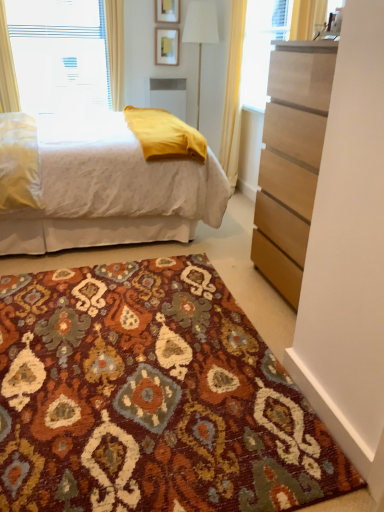
Locate an element on the screen. white plastic window at upper left is located at coordinates (115, 49).

What do you see at coordinates (167, 11) in the screenshot? I see `wooden picture frame at upper center, placed as the second picture frame when sorted from bottom to top` at bounding box center [167, 11].

The height and width of the screenshot is (512, 384). What do you see at coordinates (151, 398) in the screenshot?
I see `multicolored woven rug at center` at bounding box center [151, 398].

You are a GUI agent. You are given a task and a screenshot of the screen. Output one action in this format:
    pyautogui.click(x=<x>, y=<y>)
    Task: Click on the yellow fabric curtain at upper right, the first curtain in the right-to-left sequence
    The height and width of the screenshot is (512, 384).
    Given the screenshot: What is the action you would take?
    pyautogui.click(x=233, y=94)

From a real-world perspective, is white fabric lampshade at center physically above white plastic window at upper left?

Actually, white fabric lampshade at center is physically below white plastic window at upper left in the real world.

Is white fabric lampshade at center aimed at white plastic window at upper left?

No, white fabric lampshade at center is not facing towards white plastic window at upper left.

Find the location of a particular element. Image resolution: width=384 pixels, height=512 pixels. table lamp on the right of the white plastic window at upper left is located at coordinates (200, 33).

Does white fabric lampshade at center have a larger size compared to white plastic window at upper left?

Indeed, white fabric lampshade at center has a larger size compared to white plastic window at upper left.

From the image's perspective, is white sheer curtain at upper left, the first curtain from the left, above white fabric lampshade at center?

Indeed, from the image's perspective, white sheer curtain at upper left, the first curtain from the left, is shown above white fabric lampshade at center.

Is white sheer curtain at upper left, the first curtain from the left, directly adjacent to white fabric lampshade at center?

white sheer curtain at upper left, the first curtain from the left, is not next to white fabric lampshade at center, and they're not touching.

Does point (3, 94) appear closer or farther from the camera than point (186, 35)?

Point (3, 94).

This screenshot has height=512, width=384. In order to click on the 1st curtain in front of the white fabric lampshade at center in this screenshot , I will do 7,68.

Could you tell me if white textured bed at center is facing light brown wood chest of drawers at right?

No, white textured bed at center is not facing towards light brown wood chest of drawers at right.

Does white textured bed at center lie behind light brown wood chest of drawers at right?

Yes, it is.

Is white textured bed at center spatially inside light brown wood chest of drawers at right, or outside of it?

white textured bed at center is not inside light brown wood chest of drawers at right, it's outside.

Considering the positions of points (56, 200) and (294, 82), is point (56, 200) farther from camera compared to point (294, 82)?

Yes, it is behind point (294, 82).

Is yellow fabric curtain at upper right, positioned as the second curtain in left-to-right order, oriented towards white plastic window at upper left?

No, yellow fabric curtain at upper right, positioned as the second curtain in left-to-right order, is not turned towards white plastic window at upper left.

Does point (242, 13) come closer to viewer compared to point (122, 50)?

Yes.

Which of these two, multicolored woven rug at center or white plastic window at upper left, stands taller?

Standing taller between the two is white plastic window at upper left.

Relative to white plastic window at upper left, is multicolored woven rug at center in front or behind?

multicolored woven rug at center is in front of white plastic window at upper left.

Considering the sizes of objects multicolored woven rug at center and white plastic window at upper left in the image provided, who is thinner, multicolored woven rug at center or white plastic window at upper left?

white plastic window at upper left is thinner.

From the picture: Which of these two, white sheer curtain at upper left, the first curtain from the left, or multicolored woven rug at center, is wider?

With larger width is multicolored woven rug at center.

What's the angular difference between white sheer curtain at upper left, the first curtain from the left, and multicolored woven rug at center's facing directions?

0.748 degrees.

Is white sheer curtain at upper left, the first curtain from the left, beside multicolored woven rug at center?

No, white sheer curtain at upper left, the first curtain from the left, is not touching multicolored woven rug at center.

From a real-world perspective, which object stands above the other?

white sheer curtain at upper left, the first curtain from the left.

Considering the relative positions of light brown wood chest of drawers at right and wooden picture frame at upper center, placed as the second picture frame when sorted from bottom to top, in the image provided, is light brown wood chest of drawers at right to the left of wooden picture frame at upper center, placed as the second picture frame when sorted from bottom to top, from the viewer's perspective?

Incorrect, light brown wood chest of drawers at right is not on the left side of wooden picture frame at upper center, placed as the second picture frame when sorted from bottom to top.

Is light brown wood chest of drawers at right positioned far away from wooden picture frame at upper center, placed as the second picture frame when sorted from bottom to top?

Yes.

Considering the sizes of objects light brown wood chest of drawers at right and wooden picture frame at upper center, placed as the second picture frame when sorted from bottom to top, in the image provided, who is wider, light brown wood chest of drawers at right or wooden picture frame at upper center, placed as the second picture frame when sorted from bottom to top,?

light brown wood chest of drawers at right.

Is light brown wood chest of drawers at right oriented towards wooden picture frame at upper center, positioned as the 1th picture frame in top-to-bottom order?

No, light brown wood chest of drawers at right is not aimed at wooden picture frame at upper center, positioned as the 1th picture frame in top-to-bottom order.

The width and height of the screenshot is (384, 512). Find the location of `window above the white fabric lampshade at center (from a real-world perspective)`. window above the white fabric lampshade at center (from a real-world perspective) is located at coordinates (115, 49).

Locate an element on the screen. Image resolution: width=384 pixels, height=512 pixels. table lamp on the right of white sheer curtain at upper left, the first curtain from the left is located at coordinates (200, 33).

Estimate the real-world distances between objects in this image. Which object is further from light brown wood chest of drawers at right, white sheer curtain at upper left, the first curtain from the left, or white fabric lampshade at center?

white sheer curtain at upper left, the first curtain from the left.

When comparing their distances from yellow fabric curtain at upper right, the first curtain in the right-to-left sequence, does multicolored woven rug at center or white textured bed at center seem further?

multicolored woven rug at center.

Considering their positions, is matte gold picture frame at upper center, which appears as the first picture frame when ordered from the bottom, positioned closer to wooden picture frame at upper center, positioned as the 1th picture frame in top-to-bottom order, than yellow fabric curtain at upper right, the first curtain in the right-to-left sequence?

Based on the image, matte gold picture frame at upper center, which appears as the first picture frame when ordered from the bottom, appears to be nearer to wooden picture frame at upper center, positioned as the 1th picture frame in top-to-bottom order.

Estimate the real-world distances between objects in this image. Which object is closer to light brown wood chest of drawers at right, matte gold picture frame at upper center, which appears as the first picture frame when ordered from the bottom, or white fabric lampshade at center?

white fabric lampshade at center is closer to light brown wood chest of drawers at right.

Looking at the image, which one is located closer to white textured bed at center, white fabric lampshade at center or white plastic window at upper left?

Based on the image, white plastic window at upper left appears to be nearer to white textured bed at center.

Estimate the real-world distances between objects in this image. Which object is closer to white textured bed at center, white sheer curtain at upper left, the first curtain from the left, or white fabric lampshade at center?

white sheer curtain at upper left, the first curtain from the left, is positioned closer to the anchor white textured bed at center.

Which object lies further to the anchor point multicolored woven rug at center, white sheer curtain at upper left, which is the 2th curtain from right to left, or wooden picture frame at upper center, positioned as the 1th picture frame in top-to-bottom order?

Based on the image, wooden picture frame at upper center, positioned as the 1th picture frame in top-to-bottom order, appears to be further to multicolored woven rug at center.

Looking at the image, which one is located closer to white fabric lampshade at center, matte gold picture frame at upper center, which appears as the first picture frame when ordered from the bottom, or multicolored woven rug at center?

The object closer to white fabric lampshade at center is matte gold picture frame at upper center, which appears as the first picture frame when ordered from the bottom.

I want to click on picture frame between white sheer curtain at upper left, which is the 2th curtain from right to left, and wooden picture frame at upper center, placed as the second picture frame when sorted from bottom to top, from left to right, so click(167, 46).

Identify the location of curtain located between multicolored woven rug at center and white sheer curtain at upper left, the first curtain from the left, in the depth direction. This screenshot has height=512, width=384. (233, 94).

This screenshot has width=384, height=512. What are the coordinates of `window between light brown wood chest of drawers at right and white fabric lampshade at center from front to back` in the screenshot? It's located at (115, 49).

The width and height of the screenshot is (384, 512). Find the location of `window between white sheer curtain at upper left, the first curtain from the left, and yellow fabric curtain at upper right, positioned as the second curtain in left-to-right order, from left to right`. window between white sheer curtain at upper left, the first curtain from the left, and yellow fabric curtain at upper right, positioned as the second curtain in left-to-right order, from left to right is located at coordinates (115, 49).